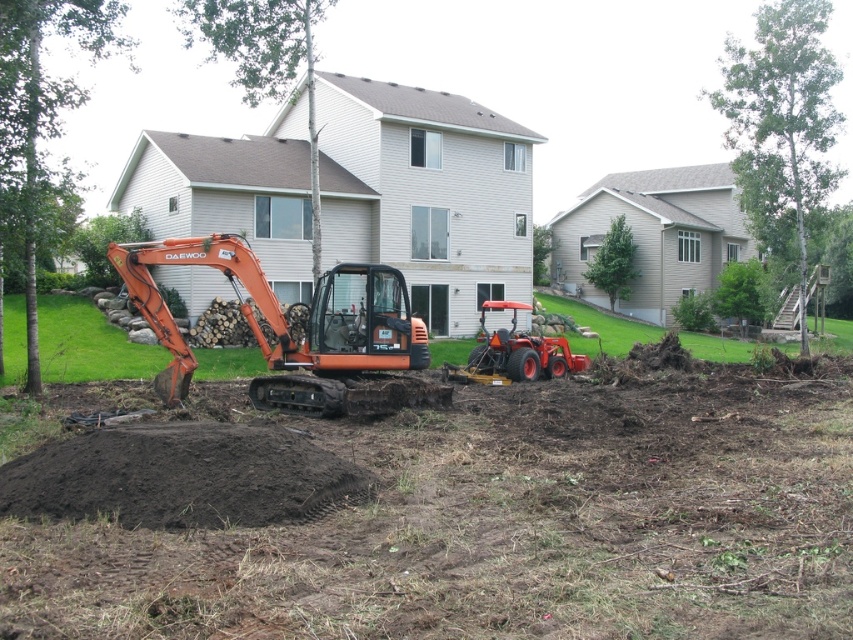
Question: Is orange rubber excavator at center further to the viewer compared to dark brown soil at center?

Choices:
 (A) no
 (B) yes

Answer: (A)

Question: Can you confirm if dark brown soil at center is smaller than orange matte/exposed metal excavator at center-left?

Choices:
 (A) no
 (B) yes

Answer: (A)

Question: Which of the following is the farthest from the observer?

Choices:
 (A) (490, 362)
 (B) (366, 540)
 (C) (177, 385)

Answer: (A)

Question: Does orange matte/exposed metal excavator at center-left appear over orange rubber tractor at center?

Choices:
 (A) yes
 (B) no

Answer: (A)

Question: Among these objects, which one is nearest to the camera?

Choices:
 (A) orange rubber tractor at center
 (B) dark brown soil at center
 (C) orange rubber excavator at center
 (D) orange matte/exposed metal excavator at center-left

Answer: (C)

Question: Among these objects, which one is nearest to the camera?

Choices:
 (A) orange rubber tractor at center
 (B) orange matte/exposed metal excavator at center-left
 (C) dark brown soil at center

Answer: (C)